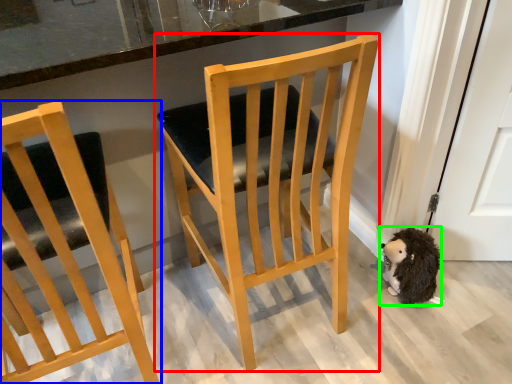
Question: Which object is positioned closest to chair (highlighted by a red box)? Select from chair (highlighted by a blue box) and animal (highlighted by a green box).

Choices:
 (A) chair
 (B) animal

Answer: (A)